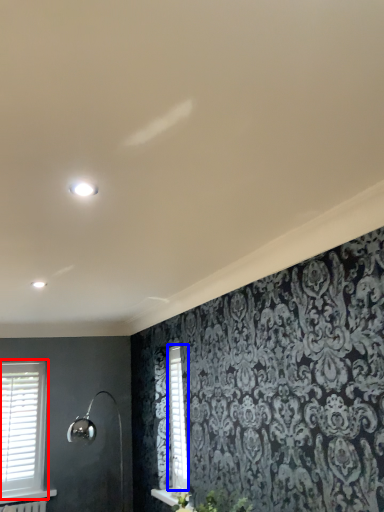
Question: Among these objects, which one is nearest to the camera, window (highlighted by a red box) or shutter (highlighted by a blue box)?

Choices:
 (A) window
 (B) shutter

Answer: (B)